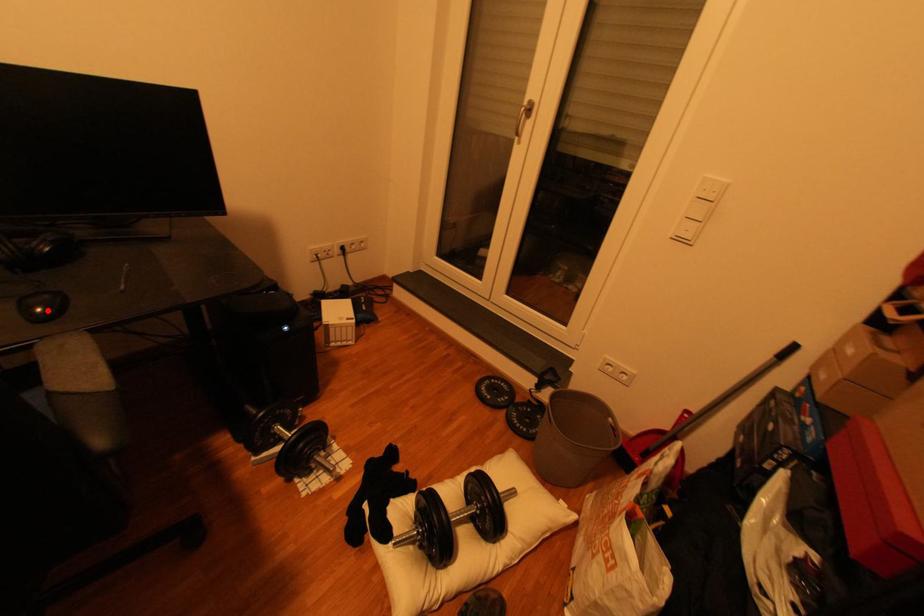
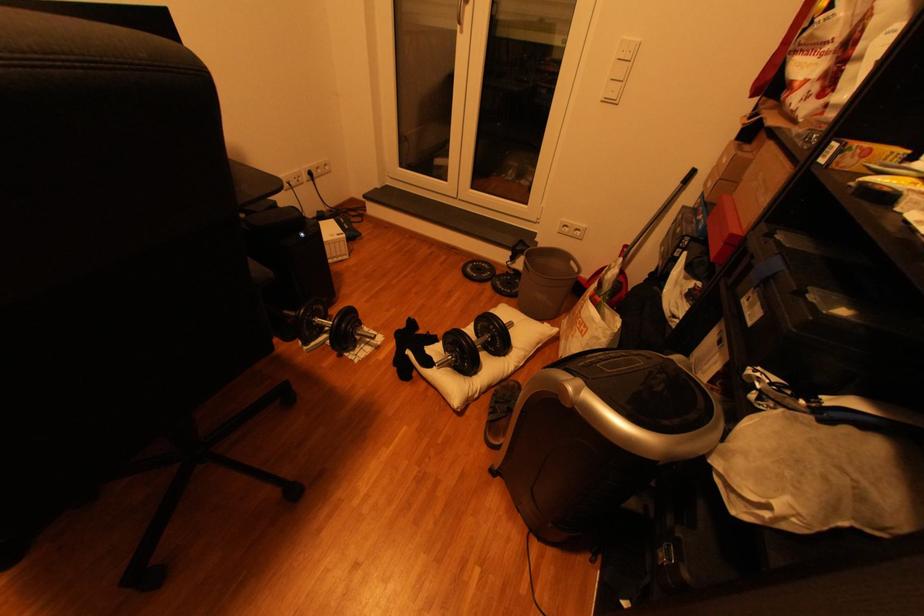
Question: I am providing you with two images of the same scene from different viewpoints. A red point is marked on the first image. Is the red point's position out of view in image 2?

Choices:
 (A) Yes
 (B) No

Answer: (A)